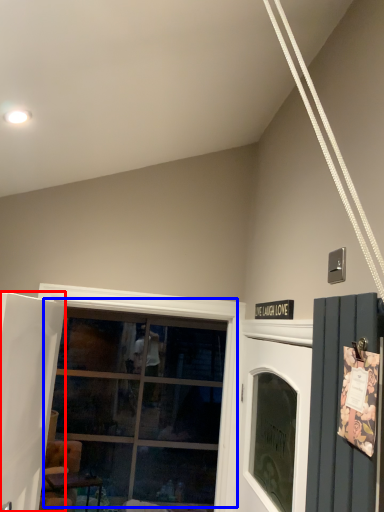
Question: Among these objects, which one is nearest to the camera, door (highlighted by a red box) or window (highlighted by a blue box)?

Choices:
 (A) door
 (B) window

Answer: (A)